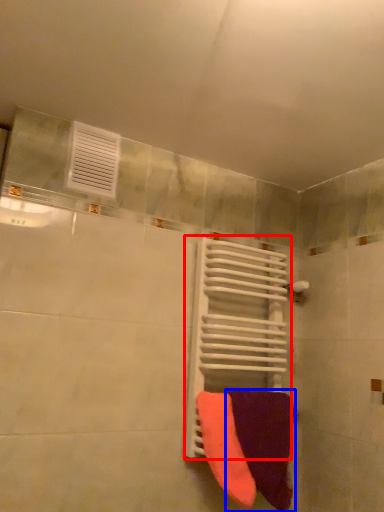
Question: Which object appears closest to the camera in this image, radiator (highlighted by a red box) or towel (highlighted by a blue box)?

Choices:
 (A) radiator
 (B) towel

Answer: (B)